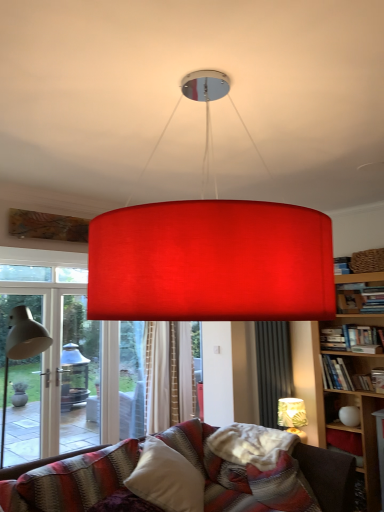
Question: Is white textured lampshade at lower right, which is the first lamp from back to front, not near matte red lampshade at center, which appears as the first lamp when viewed from the front?

Choices:
 (A) yes
 (B) no

Answer: (A)

Question: Are white textured lampshade at lower right, which is the first lamp from back to front, and matte red lampshade at center, acting as the first lamp starting from the top, beside each other?

Choices:
 (A) yes
 (B) no

Answer: (B)

Question: From a real-world perspective, is white textured lampshade at lower right, acting as the second lamp starting from the front, located higher than matte red lampshade at center, which ranks as the 2th lamp in bottom-to-top order?

Choices:
 (A) yes
 (B) no

Answer: (B)

Question: Can you confirm if white textured lampshade at lower right, the first lamp positioned from the right, is smaller than matte red lampshade at center, which ranks as the 2th lamp in bottom-to-top order?

Choices:
 (A) yes
 (B) no

Answer: (A)

Question: Is white textured lampshade at lower right, arranged as the second lamp when viewed from the top, further to camera compared to matte red lampshade at center, which is the second lamp in back-to-front order?

Choices:
 (A) no
 (B) yes

Answer: (B)

Question: From a real-world perspective, is matte white table lamp at left above or below white textured lampshade at lower right, acting as the 1th lamp starting from the bottom?

Choices:
 (A) above
 (B) below

Answer: (A)

Question: Is matte white table lamp at left to the left or to the right of white textured lampshade at lower right, which ranks as the second lamp in left-to-right order, in the image?

Choices:
 (A) right
 (B) left

Answer: (B)

Question: Looking at their shapes, would you say matte white table lamp at left is wider or thinner than white textured lampshade at lower right, acting as the second lamp starting from the front?

Choices:
 (A) thin
 (B) wide

Answer: (B)

Question: From the image's perspective, relative to white textured lampshade at lower right, which ranks as the second lamp in left-to-right order, is matte white table lamp at left above or below?

Choices:
 (A) above
 (B) below

Answer: (A)

Question: Does point (163, 309) appear closer or farther from the camera than point (41, 350)?

Choices:
 (A) farther
 (B) closer

Answer: (B)

Question: From a real-world perspective, relative to matte white table lamp at left, is matte red lampshade at center, which appears as the first lamp when viewed from the front, vertically above or below?

Choices:
 (A) above
 (B) below

Answer: (A)

Question: From the image's perspective, is matte red lampshade at center, which ranks as the 2th lamp in bottom-to-top order, positioned above or below matte white table lamp at left?

Choices:
 (A) below
 (B) above

Answer: (B)

Question: Considering their positions, is matte red lampshade at center, the 2th lamp positioned from the right, located in front of or behind matte white table lamp at left?

Choices:
 (A) front
 (B) behind

Answer: (A)

Question: Based on their sizes in the image, would you say matte white table lamp at left is bigger or smaller than matte red lampshade at center, acting as the first lamp starting from the top?

Choices:
 (A) small
 (B) big

Answer: (A)

Question: Does point (3, 460) appear closer or farther from the camera than point (170, 241)?

Choices:
 (A) closer
 (B) farther

Answer: (B)